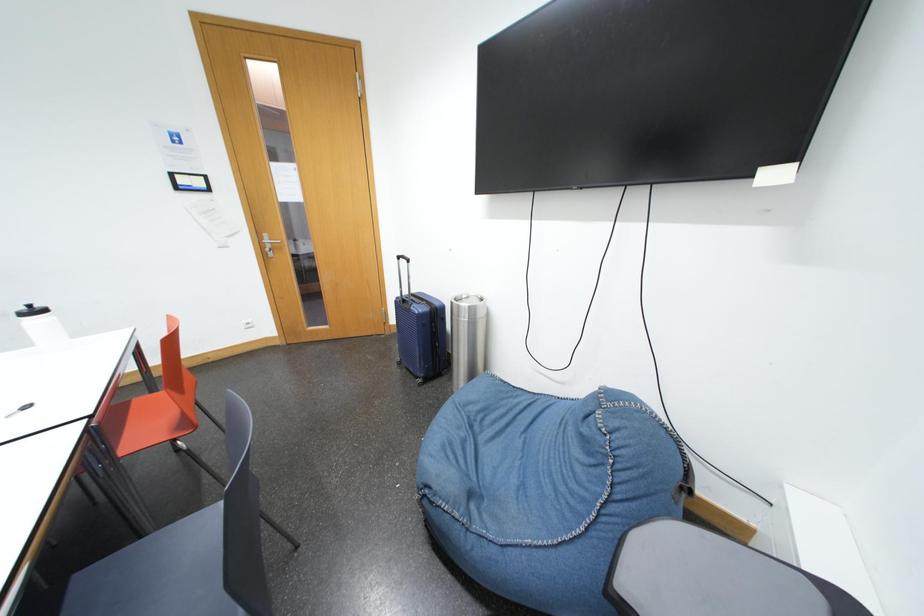
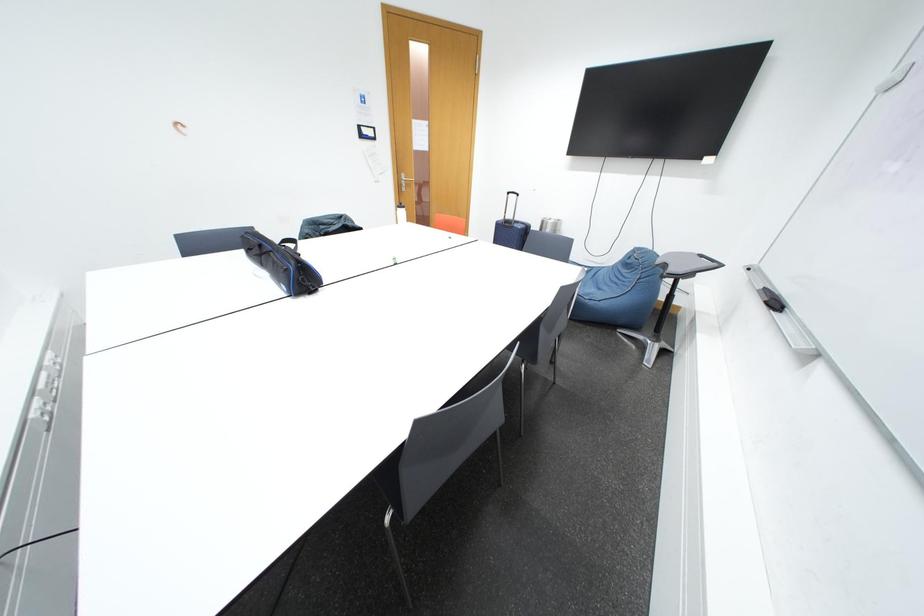
Which direction would the cameraman need to move to produce the second image?

The cameraman moved toward left, backward.